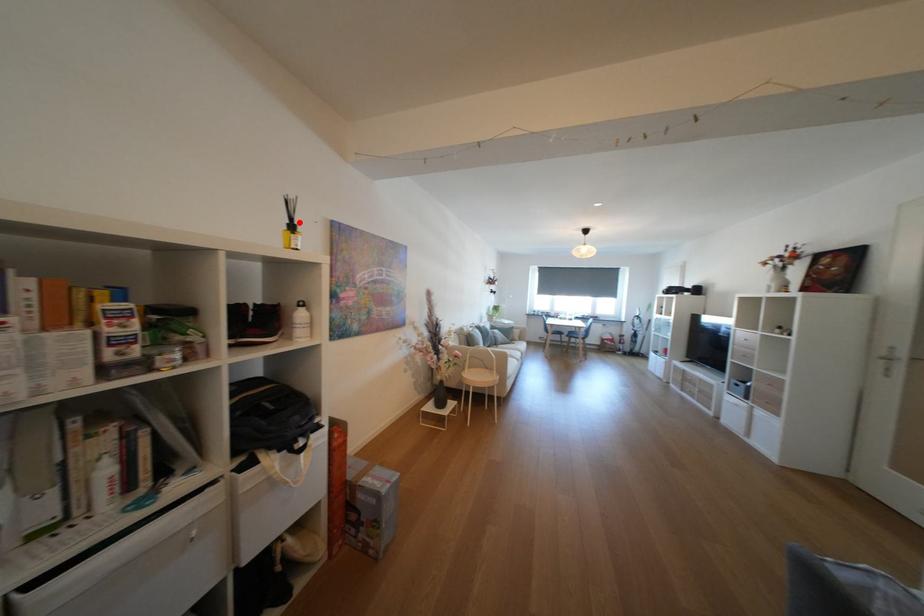
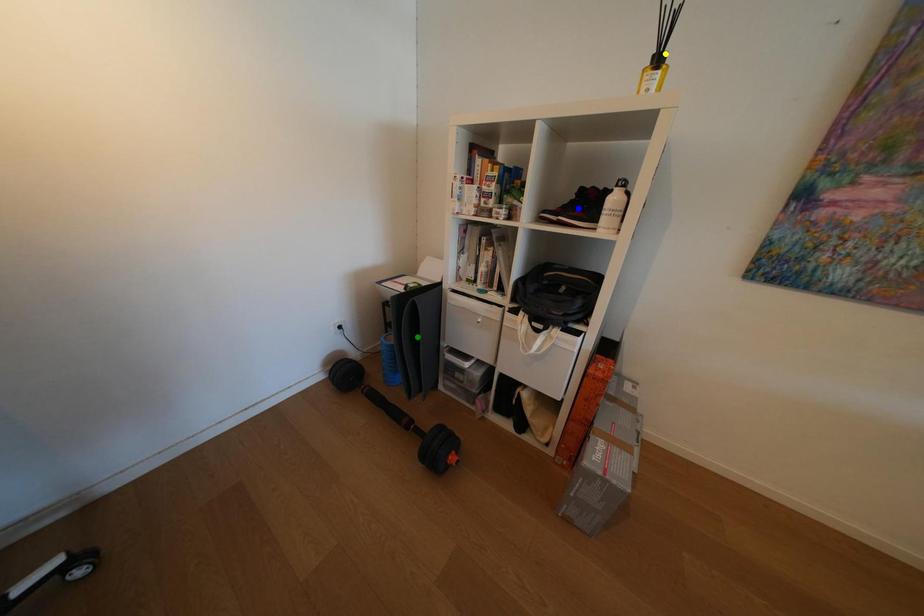
Question: I am providing you with two images of the same scene from different viewpoints. A red point is marked on the first image. You are given multiple points on the second image. In image 2, which mark is for the same physical point as the one in image 1?

Choices:
 (A) blue point
 (B) green point
 (C) yellow point

Answer: (C)